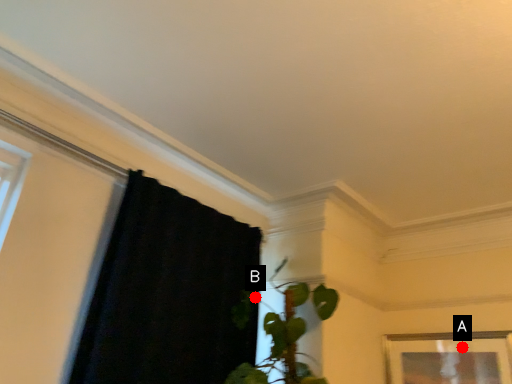
Question: Two points are circled on the image, labeled by A and B beside each circle. Which of the following is the farthest from the observer?

Choices:
 (A) A is further
 (B) B is further

Answer: (B)